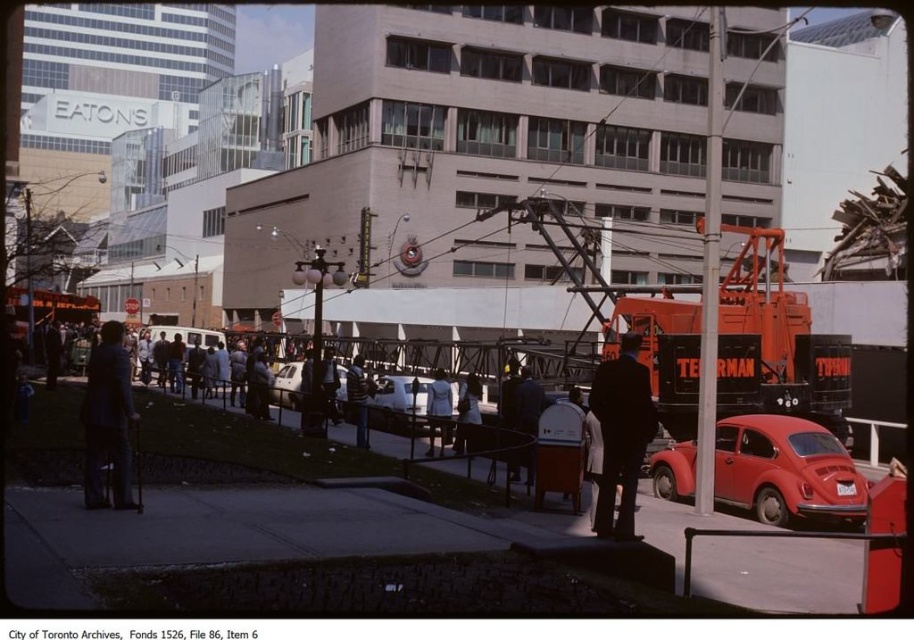
Question: Which point is farther to the camera?

Choices:
 (A) (434, 410)
 (B) (624, 451)
 (C) (115, 422)
 (D) (660, 461)

Answer: (A)

Question: Which object is the farthest from the matte red volkswagen beetle at lower right?

Choices:
 (A) light blue fabric coat at center
 (B) white cotton shirt at center
 (C) shiny silver car at center

Answer: (C)

Question: Does matte red volkswagen beetle at lower right appear on the left side of dark suit at center?

Choices:
 (A) yes
 (B) no

Answer: (B)

Question: Which object is farther from the camera taking this photo?

Choices:
 (A) dark blue suit at center
 (B) white cotton shirt at center

Answer: (B)

Question: Does white cotton shirt at center have a larger size compared to shiny silver car at center?

Choices:
 (A) no
 (B) yes

Answer: (B)

Question: Is dark blue suit at center below shiny silver car at center?

Choices:
 (A) yes
 (B) no

Answer: (B)